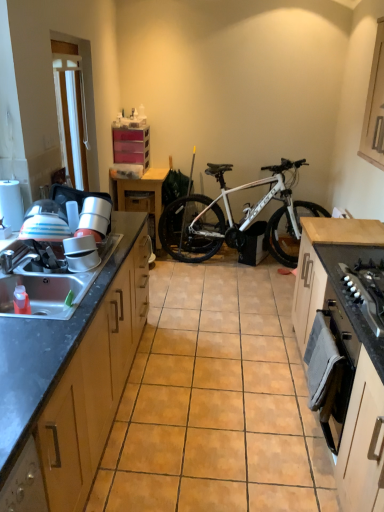
Question: From the image's perspective, is white plastic window screen at upper left above or below matte white bowl at sink, which is the 1th appliance in bottom-to-top order?

Choices:
 (A) above
 (B) below

Answer: (A)

Question: Is white plastic window screen at upper left in front of or behind matte white bowl at sink, the second appliance in the back-to-front sequence, in the image?

Choices:
 (A) behind
 (B) front

Answer: (A)

Question: Estimate the real-world distances between objects in this image. Which object is closer to the silver metallic sink at left?

Choices:
 (A) wooden table at center
 (B) metallic silver bowl at left, which is the first appliance from back to front
 (C) black matte gas stove at right
 (D) wooden drawer at center
 (E) wooden cabinet at lower right, arranged as the 3th cabinetry when viewed from the right

Answer: (B)

Question: Considering the real-world distances, which object is farthest from the white plastic window screen at upper left?

Choices:
 (A) wooden table at center
 (B) white matte oven at right, placed as the 2th cabinetry when sorted from right to left
 (C) matte black sink at left, which appears as the first cabinetry when viewed from the left
 (D) wooden cabinet at upper right, the 5th cabinetry in the left-to-right sequence
 (E) wooden cabinet at lower right, arranged as the third cabinetry when viewed from the left

Answer: (E)